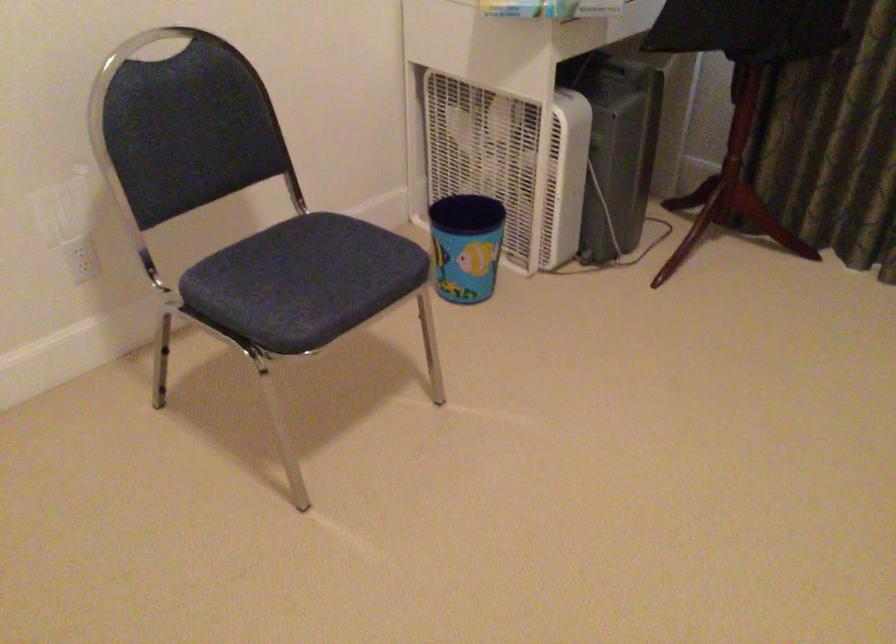
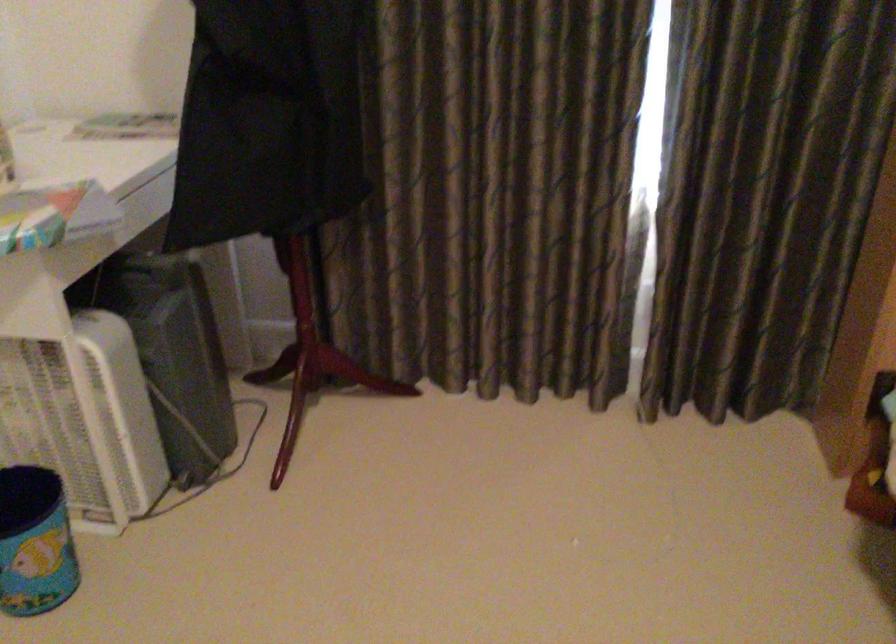
Locate, in the second image, the point that corresponds to (x=533, y=166) in the first image.

(82, 413)